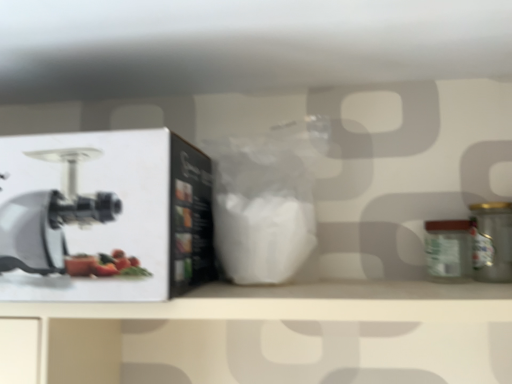
Question: From the image's perspective, is metallic gold canister at right below green matte glass jar at right?

Choices:
 (A) yes
 (B) no

Answer: (B)

Question: Is the position of metallic gold canister at right more distant than that of green matte glass jar at right?

Choices:
 (A) no
 (B) yes

Answer: (A)

Question: Can you confirm if metallic gold canister at right is bigger than green matte glass jar at right?

Choices:
 (A) no
 (B) yes

Answer: (B)

Question: Is green matte glass jar at right surrounded by metallic gold canister at right?

Choices:
 (A) no
 (B) yes

Answer: (A)

Question: Does metallic gold canister at right appear on the left side of green matte glass jar at right?

Choices:
 (A) no
 (B) yes

Answer: (A)

Question: From the image's perspective, is white matte box at left located above or below green matte glass jar at right?

Choices:
 (A) above
 (B) below

Answer: (A)

Question: From a real-world perspective, is white matte box at left physically located above or below green matte glass jar at right?

Choices:
 (A) below
 (B) above

Answer: (B)

Question: In terms of width, does white matte box at left look wider or thinner when compared to green matte glass jar at right?

Choices:
 (A) wide
 (B) thin

Answer: (A)

Question: Considering the relative positions of white matte box at left and green matte glass jar at right in the image provided, is white matte box at left to the left or to the right of green matte glass jar at right?

Choices:
 (A) left
 (B) right

Answer: (A)

Question: Is green matte glass jar at right to the left or to the right of white matte box at left in the image?

Choices:
 (A) left
 (B) right

Answer: (B)

Question: From the image's perspective, is green matte glass jar at right above or below white matte box at left?

Choices:
 (A) above
 (B) below

Answer: (B)

Question: In terms of width, does green matte glass jar at right look wider or thinner when compared to white matte box at left?

Choices:
 (A) wide
 (B) thin

Answer: (B)

Question: Would you say green matte glass jar at right is inside or outside white matte box at left?

Choices:
 (A) inside
 (B) outside

Answer: (B)

Question: Considering the positions of metallic gold canister at right and white matte box at left in the image, is metallic gold canister at right bigger or smaller than white matte box at left?

Choices:
 (A) big
 (B) small

Answer: (B)

Question: Considering the positions of metallic gold canister at right and white matte box at left in the image, is metallic gold canister at right taller or shorter than white matte box at left?

Choices:
 (A) tall
 (B) short

Answer: (B)